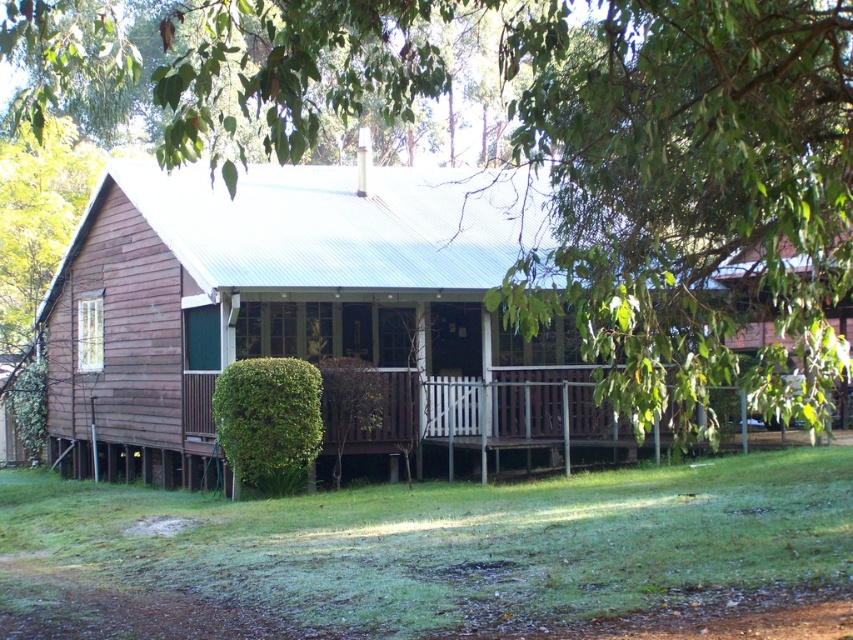
Image resolution: width=853 pixels, height=640 pixels. What do you see at coordinates (592, 161) in the screenshot?
I see `green leafy tree at center` at bounding box center [592, 161].

Is green leafy tree at center positioned behind green grass at lower center?

No, it is not.

Measure the distance between green leafy tree at center and camera.

4.03 meters

Where is `green leafy tree at center`? green leafy tree at center is located at coordinates (592, 161).